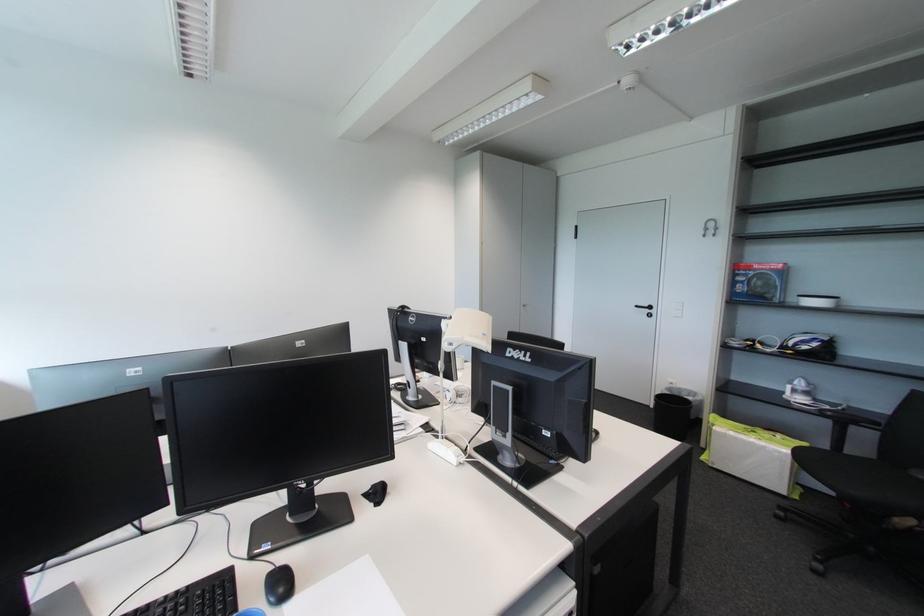
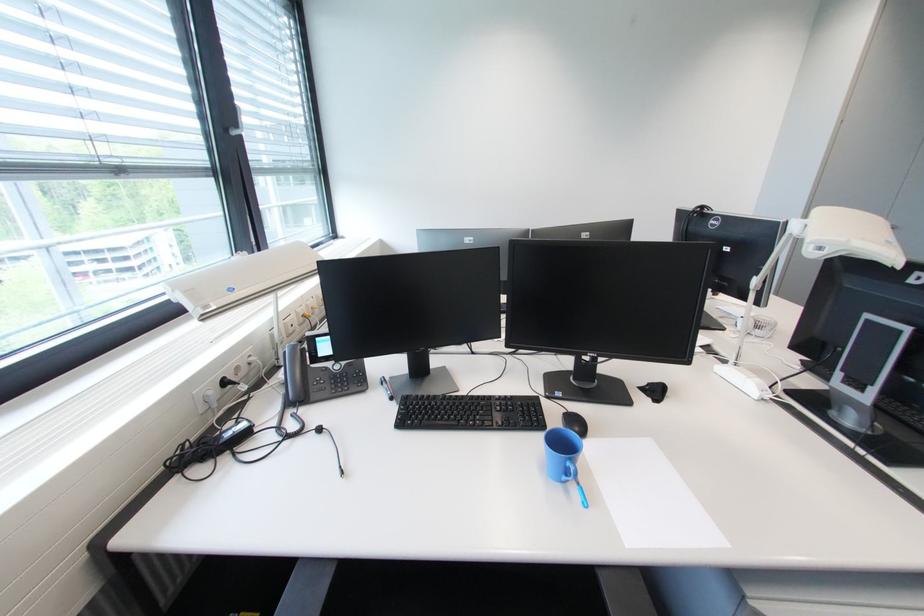
Where in the second image is the point corresponding to point (468, 339) from the first image?

(856, 243)